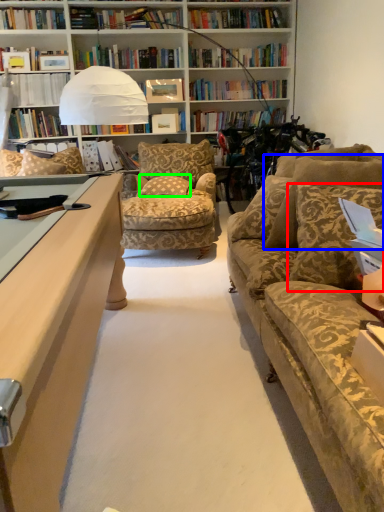
Question: Which object is the farthest from pillow (highlighted by a red box)? Choose among these: pillow (highlighted by a blue box) or pillow (highlighted by a green box).

Choices:
 (A) pillow
 (B) pillow

Answer: (B)